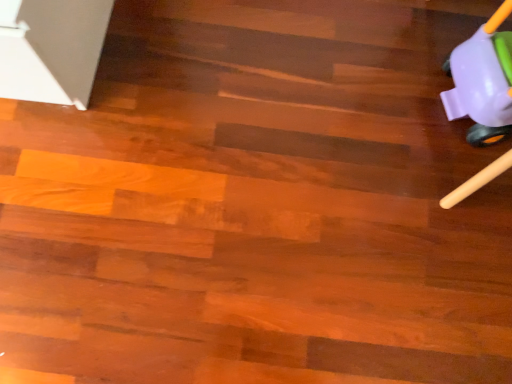
In order to click on purple plastic toy at upper right in this screenshot , I will do `click(483, 81)`.

The height and width of the screenshot is (384, 512). Describe the element at coordinates (483, 81) in the screenshot. I see `purple plastic toy at upper right` at that location.

At what (x,y) coordinates should I click in order to perform the action: click on purple plastic toy at upper right. Please return your answer as a coordinate pair (x, y). The image size is (512, 384). Looking at the image, I should click on (483, 81).